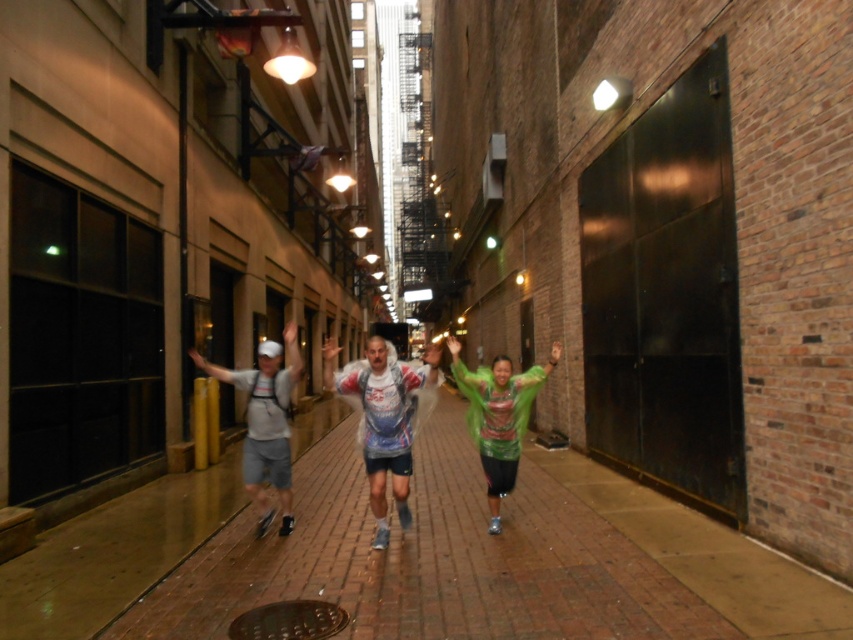
Which of these two, white matte running suit at center or green matte jacket at center, stands shorter?

Standing shorter between the two is green matte jacket at center.

Which is in front, point (380, 547) or point (480, 458)?

Point (380, 547)

The height and width of the screenshot is (640, 853). Identify the location of white matte running suit at center. (383, 419).

Between green matte jacket at center and brown textured manhole cover at lower center, which one has less height?

brown textured manhole cover at lower center

Can you confirm if green matte jacket at center is positioned to the right of brown textured manhole cover at lower center?

Yes, green matte jacket at center is to the right of brown textured manhole cover at lower center.

Is point (498, 458) farther from camera compared to point (260, 621)?

Yes, it is.

Identify the location of green matte jacket at center. The width and height of the screenshot is (853, 640). (498, 416).

Who is higher up, brick pavement at center or white matte running suit at center?

white matte running suit at center is higher up.

Can you confirm if brick pavement at center is positioned above white matte running suit at center?

Actually, brick pavement at center is below white matte running suit at center.

Who is more forward, (13,570) or (364,385)?

Point (13,570) is in front.

Find the location of a particular element. brick pavement at center is located at coordinates (500, 557).